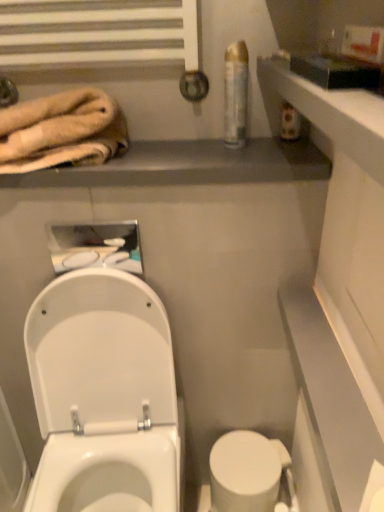
Question: Is beige plush towel at upper left inside the boundaries of white glossy toilet at lower left, or outside?

Choices:
 (A) outside
 (B) inside

Answer: (A)

Question: In the image, is beige plush towel at upper left on the left side or the right side of white glossy toilet at lower left?

Choices:
 (A) left
 (B) right

Answer: (A)

Question: Which object is positioned farthest from the beige plush towel at upper left?

Choices:
 (A) clear plastic can at upper right
 (B) white glossy toilet bowl at lower center
 (C) metallic gray balustrade at upper center
 (D) white glossy toilet at lower left

Answer: (B)

Question: Based on their relative distances, which object is nearer to the white glossy toilet bowl at lower center?

Choices:
 (A) white glossy toilet at lower left
 (B) clear plastic can at upper right
 (C) beige plush towel at upper left
 (D) metallic gray balustrade at upper center

Answer: (A)